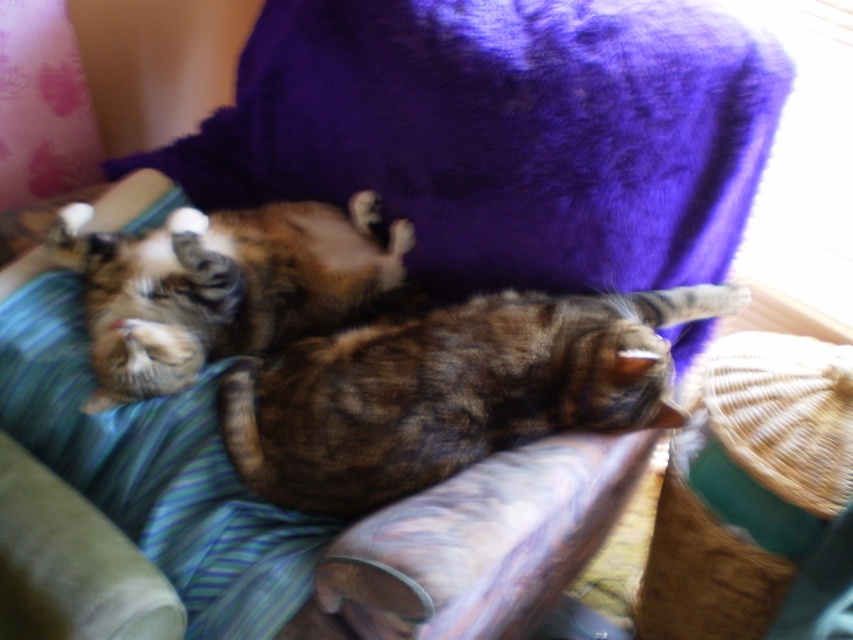
Is point (732, 292) positioned behind point (132, 316)?

Yes, point (732, 292) is behind point (132, 316).

Which is behind, point (604, 368) or point (103, 301)?

The point (103, 301) is more distant.

Does point (380, 472) lie in front of point (282, 220)?

Yes, point (380, 472) is closer to viewer.

The width and height of the screenshot is (853, 640). Identify the location of brown fur cat at center. (450, 390).